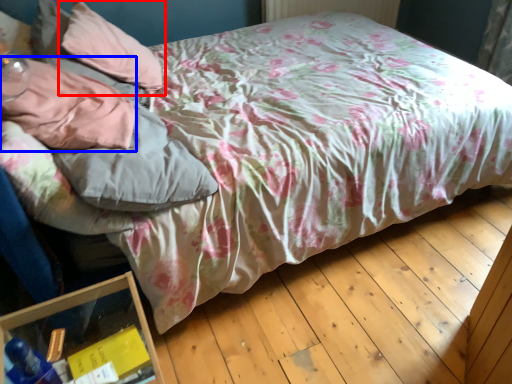
Question: Which object is closer to the camera taking this photo, pillow (highlighted by a red box) or pillow (highlighted by a blue box)?

Choices:
 (A) pillow
 (B) pillow

Answer: (B)